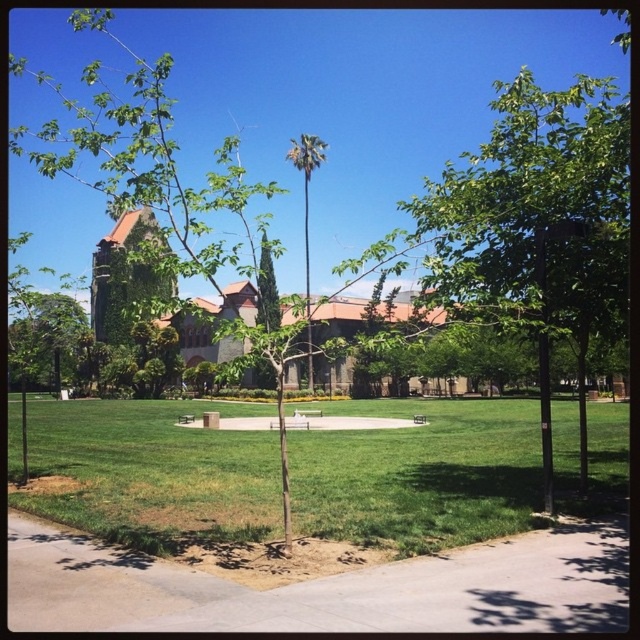
You are a gardener planning to plant a new tree in the park. You have a limited space between the green leafy palm at center and the green leafy tree at center. Which tree should you choose to ensure it fits within the space without overcrowding?

The green leafy palm at center has a greater width than the green leafy tree at center. Therefore, to avoid overcrowding, you should choose the green leafy tree at center for planting in the limited space.

You are a park visitor standing at the entrance of the park. You see the gray concrete sidewalk at lower center and the brown wooden bench at center. Which object is positioned to the right of the other?

The gray concrete sidewalk at lower center is to the right of brown wooden bench at center.